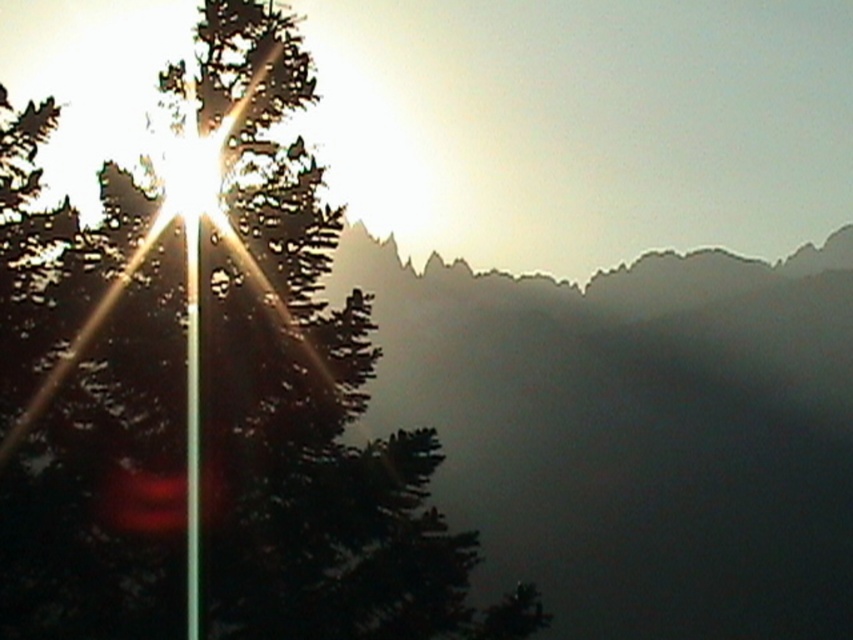
Is green matte tree at upper left positioned at the back of metallic pole at left?

That is False.

Can you confirm if green matte tree at upper left is bigger than metallic pole at left?

Yes, green matte tree at upper left is bigger than metallic pole at left.

Find the location of a particular element. green matte tree at upper left is located at coordinates (209, 390).

Locate an element on the screen. The width and height of the screenshot is (853, 640). green matte tree at upper left is located at coordinates (209, 390).